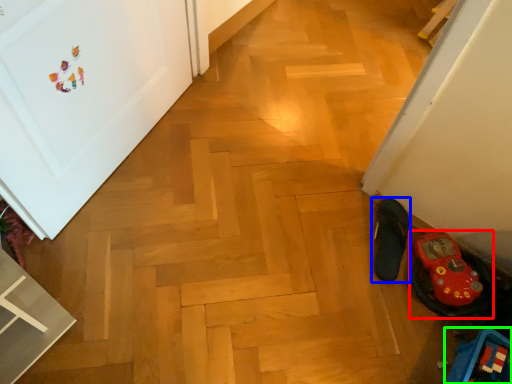
Question: Which object is positioned closest to footwear (highlighted by a red box)? Select from footwear (highlighted by a blue box) and toy (highlighted by a green box).

Choices:
 (A) footwear
 (B) toy

Answer: (A)